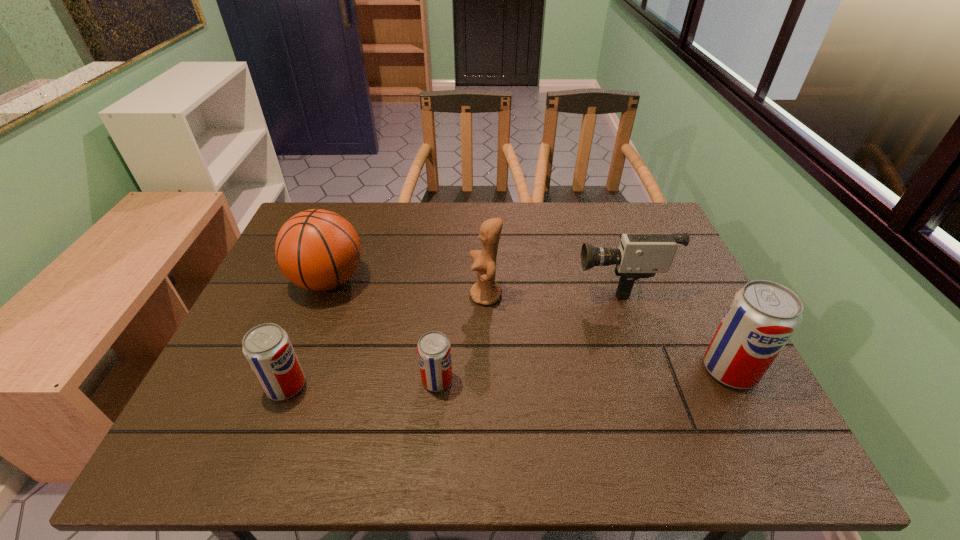
Where is `basketball that is at the left edge`? The image size is (960, 540). basketball that is at the left edge is located at coordinates (318, 250).

You are a GUI agent. You are given a task and a screenshot of the screen. Output one action in this format:
    pyautogui.click(x=<x>, y=<y>)
    Task: Click on the soda that is at the right edge
    
    Given the screenshot: What is the action you would take?
    pyautogui.click(x=763, y=315)

Image resolution: width=960 pixels, height=540 pixels. I want to click on camcorder that is at the right edge, so click(639, 256).

The image size is (960, 540). What are the coordinates of `object positioned at the near left corner` in the screenshot? It's located at (267, 347).

The image size is (960, 540). I want to click on object located at the near right corner, so click(x=763, y=315).

In the image, there is a desktop. Find the location of `blank space at the far edge`. blank space at the far edge is located at coordinates [355, 230].

Locate an element on the screen. This screenshot has width=960, height=540. vacant space at the near edge of the desktop is located at coordinates (489, 416).

In the image, there is a desktop. What are the coordinates of `vacant space at the left edge` in the screenshot? It's located at (226, 363).

Locate an element on the screen. This screenshot has width=960, height=540. vacant space at the right edge of the desktop is located at coordinates (674, 303).

You are a GUI agent. You are given a task and a screenshot of the screen. Output one action in this format:
    pyautogui.click(x=<x>, y=<y>)
    Task: Click on the vacant region between the third object from right to left and the shortest soda
    The image size is (960, 540).
    Given the screenshot: What is the action you would take?
    pyautogui.click(x=462, y=338)